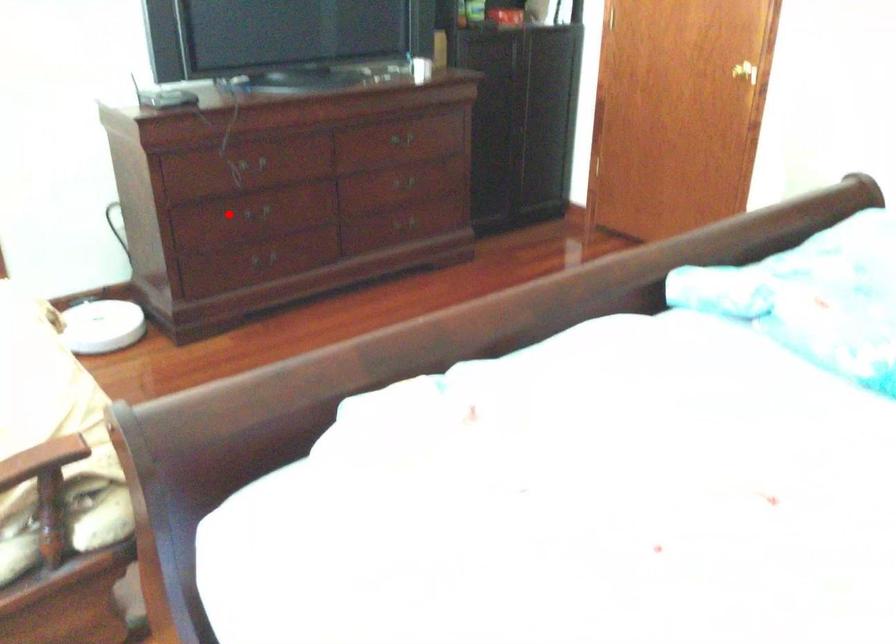
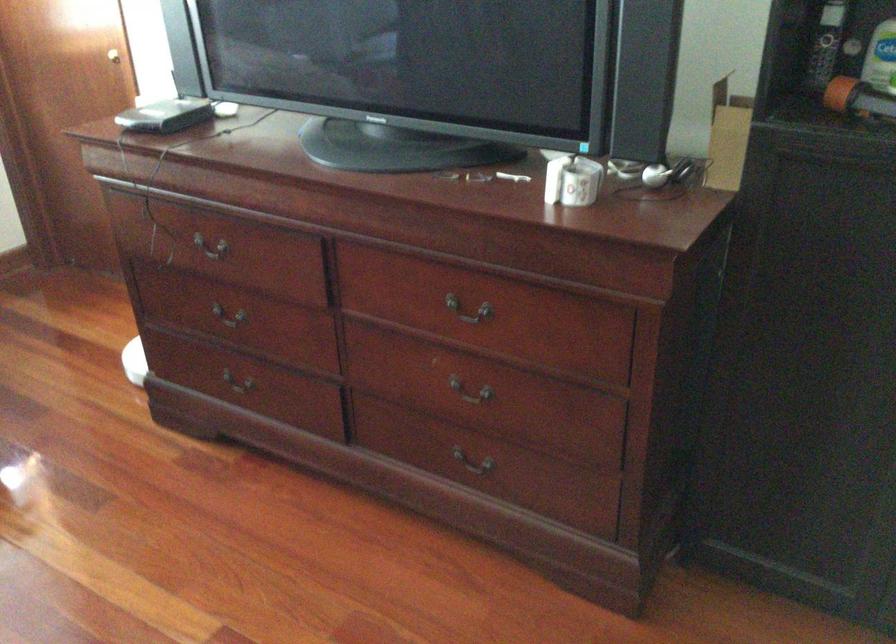
Question: I am providing you with two images of the same scene from different viewpoints. In image1, a red point is highlighted. Considering the same 3D point in image2, which of the following is correct?

Choices:
 (A) It is closer
 (B) It is farther

Answer: (A)